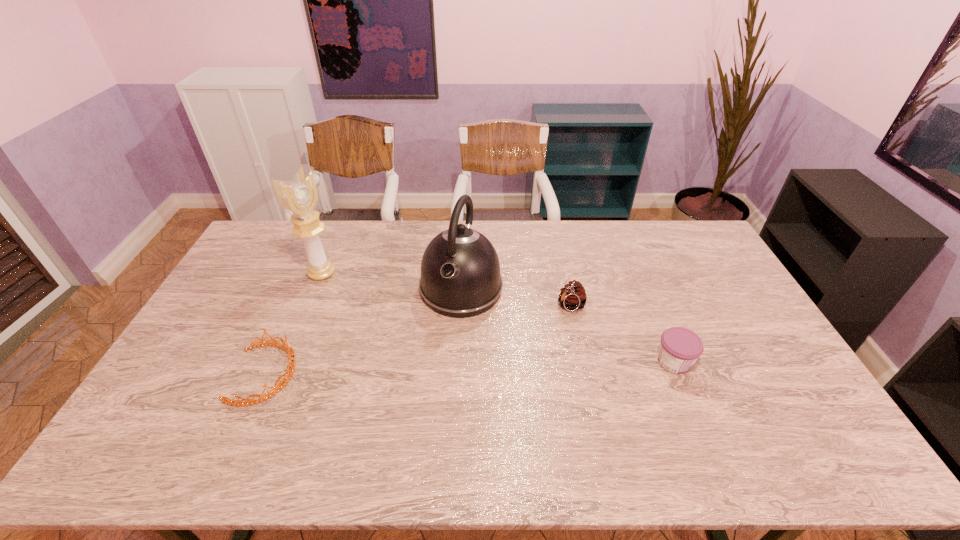
I want to click on free region located 0.070m with a leaf charm attached to the pinecone, so click(x=548, y=326).

You are a GUI agent. You are given a task and a screenshot of the screen. Output one action in this format:
    pyautogui.click(x=<x>, y=<y>)
    Task: Click on the free point located on the front-facing side of the award
    This screenshot has height=540, width=960.
    Given the screenshot: What is the action you would take?
    pyautogui.click(x=399, y=315)

Find the location of `vacant space located on the front-facing side of the award`. vacant space located on the front-facing side of the award is located at coordinates (359, 294).

This screenshot has width=960, height=540. I want to click on vacant area situated on the front-facing side of the award, so click(363, 296).

Locate an element on the screen. vacant space located 0.240m on the spout of the kettle is located at coordinates (426, 384).

You are a GUI agent. You are given a task and a screenshot of the screen. Output one action in this format:
    pyautogui.click(x=<x>, y=<y>)
    Task: Click on the vacant space positioned 0.130m on the spout of the kettle
    
    Given the screenshot: What is the action you would take?
    pyautogui.click(x=438, y=353)

At what (x,y) coordinates should I click in order to perform the action: click on blank space located on the spout of the kettle. Please return your answer as a coordinate pair (x, y). The height and width of the screenshot is (540, 960). Looking at the image, I should click on (432, 369).

The image size is (960, 540). In order to click on object positioned at the near edge in this screenshot , I will do pos(289,372).

Image resolution: width=960 pixels, height=540 pixels. What are the coordinates of `vacant space at the far edge of the desktop` in the screenshot? It's located at (622, 249).

Where is `vacant area at the near edge of the desktop`? vacant area at the near edge of the desktop is located at coordinates (552, 423).